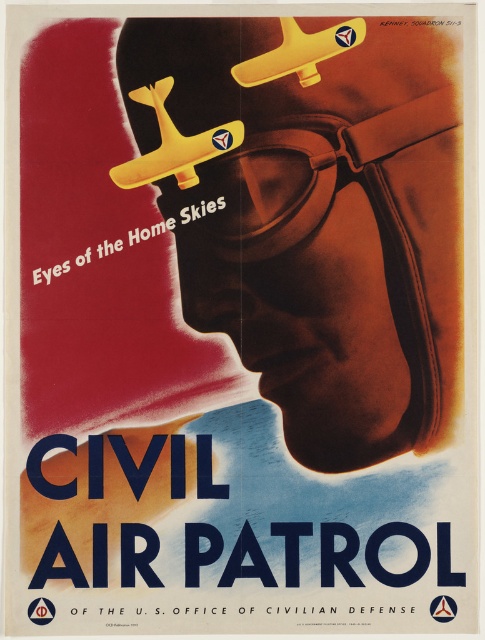
Who is positioned more to the left, metallic star at center or metallic red star at center?

From the viewer's perspective, metallic red star at center appears more on the left side.

Does metallic star at center appear over metallic red star at center?

No.

Is point (438, 602) in front of point (353, 33)?

Yes.

The image size is (485, 640). I want to click on metallic star at center, so click(442, 609).